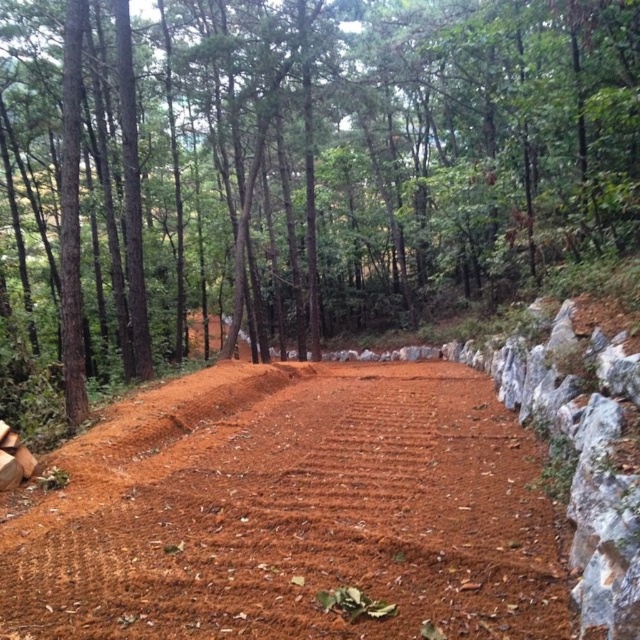
Does brown dirt road at center have a greater height compared to brown textured dirt track at center?

Yes, brown dirt road at center is taller than brown textured dirt track at center.

Is brown dirt road at center above brown textured dirt track at center?

Indeed, brown dirt road at center is positioned over brown textured dirt track at center.

Is point (483, 211) positioned before point (180, 614)?

No, (483, 211) is behind (180, 614).

Where is `brown dirt road at center`? Image resolution: width=640 pixels, height=640 pixels. brown dirt road at center is located at coordinates (312, 160).